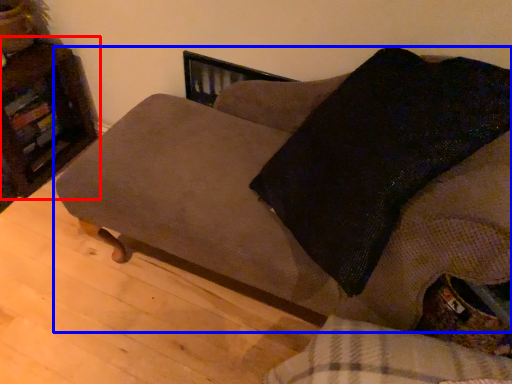
Question: Which object is further to the camera taking this photo, furniture (highlighted by a red box) or studio couch (highlighted by a blue box)?

Choices:
 (A) furniture
 (B) studio couch

Answer: (A)